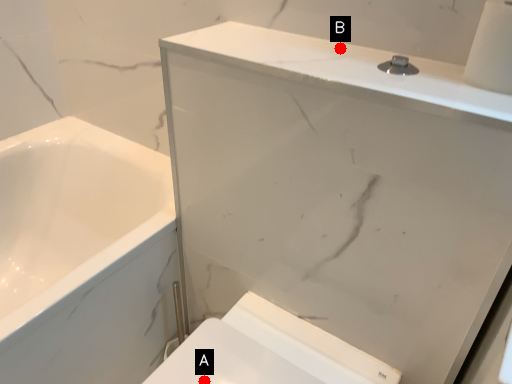
Question: Two points are circled on the image, labeled by A and B beside each circle. Which point is closer to the camera?

Choices:
 (A) A is closer
 (B) B is closer

Answer: (A)